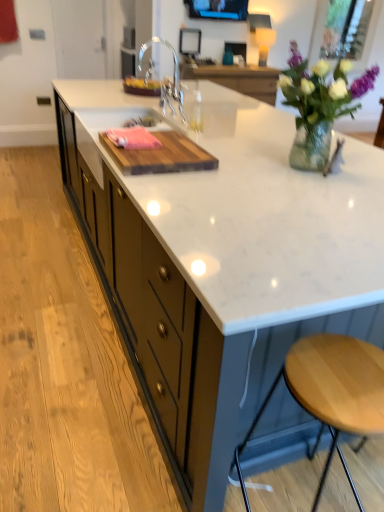
Question: Is the surface of wooden cutting board at center in direct contact with chrome metallic faucet at center?

Choices:
 (A) yes
 (B) no

Answer: (B)

Question: Can you confirm if wooden cutting board at center is shorter than chrome metallic faucet at center?

Choices:
 (A) no
 (B) yes

Answer: (B)

Question: Is wooden cutting board at center facing away from chrome metallic faucet at center?

Choices:
 (A) no
 (B) yes

Answer: (A)

Question: From a real-world perspective, is wooden cutting board at center beneath chrome metallic faucet at center?

Choices:
 (A) yes
 (B) no

Answer: (A)

Question: Is wooden cutting board at center not near chrome metallic faucet at center?

Choices:
 (A) yes
 (B) no

Answer: (B)

Question: From their relative heights in the image, would you say chrome metallic faucet at center is taller or shorter than matte black tv at upper center, arranged as the second window screen when viewed from the right?

Choices:
 (A) short
 (B) tall

Answer: (B)

Question: In terms of width, does chrome metallic faucet at center look wider or thinner when compared to matte black tv at upper center, acting as the 1th window screen starting from the front?

Choices:
 (A) thin
 (B) wide

Answer: (B)

Question: Considering the positions of chrome metallic faucet at center and matte black tv at upper center, which appears as the second window screen when viewed from the back, in the image, is chrome metallic faucet at center bigger or smaller than matte black tv at upper center, which appears as the second window screen when viewed from the back,?

Choices:
 (A) big
 (B) small

Answer: (A)

Question: From a real-world perspective, is chrome metallic faucet at center physically located above or below matte black tv at upper center, arranged as the second window screen when viewed from the right?

Choices:
 (A) above
 (B) below

Answer: (B)

Question: Considering the relative positions of wooden cutting board at center and light brown wood stool at lower right in the image provided, is wooden cutting board at center to the left or to the right of light brown wood stool at lower right?

Choices:
 (A) right
 (B) left

Answer: (B)

Question: From the image's perspective, relative to light brown wood stool at lower right, is wooden cutting board at center above or below?

Choices:
 (A) above
 (B) below

Answer: (A)

Question: From a real-world perspective, is wooden cutting board at center physically located above or below light brown wood stool at lower right?

Choices:
 (A) below
 (B) above

Answer: (B)

Question: Considering their positions, is wooden cutting board at center located in front of or behind light brown wood stool at lower right?

Choices:
 (A) front
 (B) behind

Answer: (B)

Question: In terms of width, does matte black tv at upper center, which appears as the second window screen when viewed from the back, look wider or thinner when compared to light brown wood stool at lower right?

Choices:
 (A) thin
 (B) wide

Answer: (A)

Question: Does point (198, 13) appear closer or farther from the camera than point (327, 364)?

Choices:
 (A) farther
 (B) closer

Answer: (A)